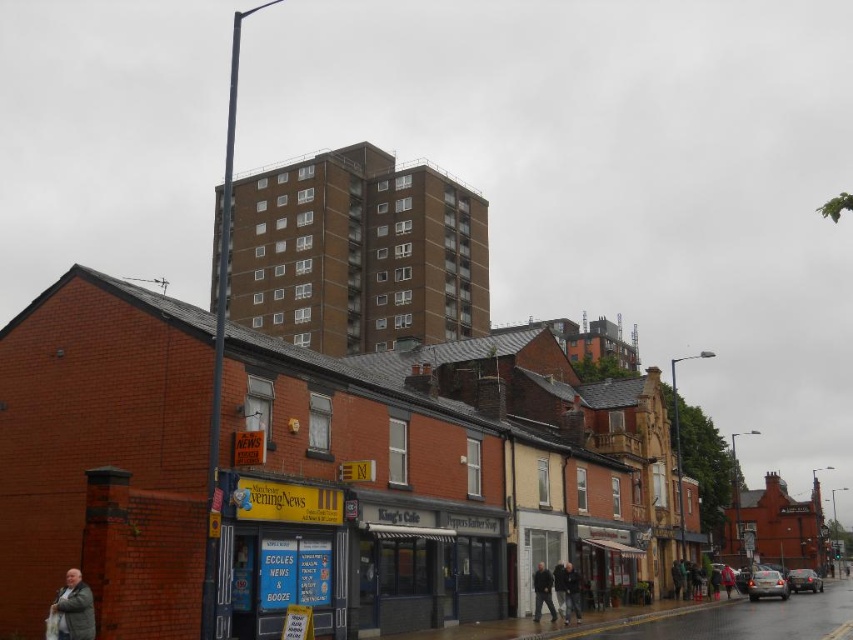
Between point (538, 618) and point (572, 577), which one is positioned in front?

Point (538, 618) is more forward.

Is dark gray jacket at center wider than dark gray jacket at lower center?

Correct, the width of dark gray jacket at center exceeds that of dark gray jacket at lower center.

Which is in front, point (547, 596) or point (576, 598)?

Point (547, 596)

Find the location of a particular element. dark gray jacket at center is located at coordinates (543, 593).

Can you confirm if gray wool coat at lower left is positioned below dark gray jacket at center?

Incorrect, gray wool coat at lower left is not positioned below dark gray jacket at center.

Is gray wool coat at lower left bigger than dark gray jacket at center?

No.

Is point (84, 593) farther from viewer compared to point (535, 580)?

No, it is not.

Locate an element on the screen. This screenshot has width=853, height=640. gray wool coat at lower left is located at coordinates (74, 609).

Between gray wool coat at lower left and dark gray jacket at lower center, which one appears on the right side from the viewer's perspective?

dark gray jacket at lower center

Is gray wool coat at lower left behind dark gray jacket at lower center?

No, gray wool coat at lower left is closer to the viewer.

Describe the element at coordinates (74, 609) in the screenshot. This screenshot has height=640, width=853. I see `gray wool coat at lower left` at that location.

The image size is (853, 640). I want to click on gray wool coat at lower left, so click(74, 609).